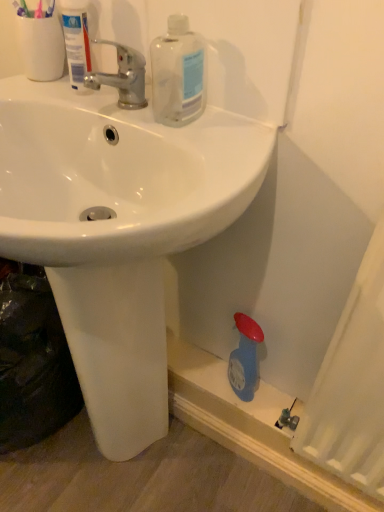
Question: Can you confirm if white plastic tube at upper left is positioned to the right of chrome metallic faucet at upper center?

Choices:
 (A) no
 (B) yes

Answer: (A)

Question: From the image's perspective, is white plastic tube at upper left below chrome metallic faucet at upper center?

Choices:
 (A) yes
 (B) no

Answer: (B)

Question: Is white plastic tube at upper left taller than chrome metallic faucet at upper center?

Choices:
 (A) yes
 (B) no

Answer: (A)

Question: Is white plastic tube at upper left behind chrome metallic faucet at upper center?

Choices:
 (A) no
 (B) yes

Answer: (B)

Question: From a real-world perspective, is white plastic tube at upper left under chrome metallic faucet at upper center?

Choices:
 (A) no
 (B) yes

Answer: (A)

Question: Is white glossy sink at center taller or shorter than chrome metallic faucet at upper center?

Choices:
 (A) short
 (B) tall

Answer: (B)

Question: Looking at the image, does white glossy sink at center seem bigger or smaller compared to chrome metallic faucet at upper center?

Choices:
 (A) small
 (B) big

Answer: (B)

Question: From the image's perspective, is white glossy sink at center located above or below chrome metallic faucet at upper center?

Choices:
 (A) above
 (B) below

Answer: (B)

Question: In the image, is white glossy sink at center positioned in front of or behind chrome metallic faucet at upper center?

Choices:
 (A) front
 (B) behind

Answer: (A)

Question: Considering the positions of point (183, 25) and point (77, 32), is point (183, 25) closer or farther from the camera than point (77, 32)?

Choices:
 (A) farther
 (B) closer

Answer: (B)

Question: From the image's perspective, relative to white plastic tube at upper left, is transparent plastic bottle at upper center above or below?

Choices:
 (A) above
 (B) below

Answer: (B)

Question: Considering the positions of transparent plastic bottle at upper center and white plastic tube at upper left in the image, is transparent plastic bottle at upper center taller or shorter than white plastic tube at upper left?

Choices:
 (A) tall
 (B) short

Answer: (B)

Question: From a real-world perspective, is transparent plastic bottle at upper center above or below white plastic tube at upper left?

Choices:
 (A) below
 (B) above

Answer: (A)

Question: From their relative heights in the image, would you say white glossy sink at center is taller or shorter than transparent plastic bottle at upper center?

Choices:
 (A) short
 (B) tall

Answer: (B)

Question: From a real-world perspective, is white glossy sink at center above or below transparent plastic bottle at upper center?

Choices:
 (A) below
 (B) above

Answer: (A)